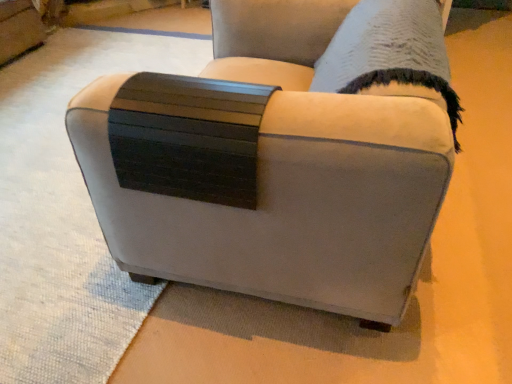
Find the location of a particular element. Image resolution: width=512 pixels, height=384 pixels. suede-like beige armchair at center is located at coordinates (267, 169).

Measure the distance between point (281,240) and camera.

Point (281,240) and camera are 3.58 feet apart from each other.

The height and width of the screenshot is (384, 512). Describe the element at coordinates (267, 169) in the screenshot. I see `suede-like beige armchair at center` at that location.

Where is `suede-like beige armchair at center`? This screenshot has width=512, height=384. suede-like beige armchair at center is located at coordinates (267, 169).